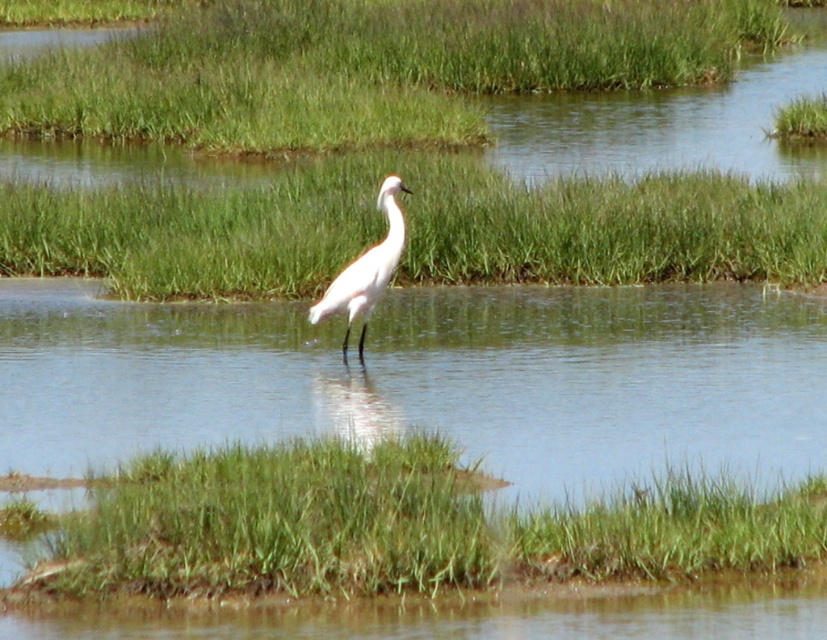
Does point (93, 595) come in front of point (436, 276)?

Yes, point (93, 595) is in front of point (436, 276).

Can you confirm if green grassy at lower center is taller than green grass at center?

Indeed, green grassy at lower center has a greater height compared to green grass at center.

Where is `green grassy at lower center`? This screenshot has height=640, width=827. green grassy at lower center is located at coordinates (404, 525).

Is green grassy at lower center further to camera compared to white matte bird at center?

No, green grassy at lower center is in front of white matte bird at center.

Is green grassy at lower center to the left of white matte bird at center from the viewer's perspective?

In fact, green grassy at lower center is to the right of white matte bird at center.

Is point (206, 570) positioned before point (383, 186)?

Yes, it is.

The height and width of the screenshot is (640, 827). What are the coordinates of `green grassy at lower center` in the screenshot? It's located at (404, 525).

Who is shorter, green grass at center or white matte bird at center?

Standing shorter between the two is green grass at center.

The width and height of the screenshot is (827, 640). What do you see at coordinates (414, 228) in the screenshot?
I see `green grass at center` at bounding box center [414, 228].

Who is more distant from viewer, (275, 275) or (381, 246)?

Point (275, 275)

The width and height of the screenshot is (827, 640). Find the location of `green grass at center`. green grass at center is located at coordinates (414, 228).